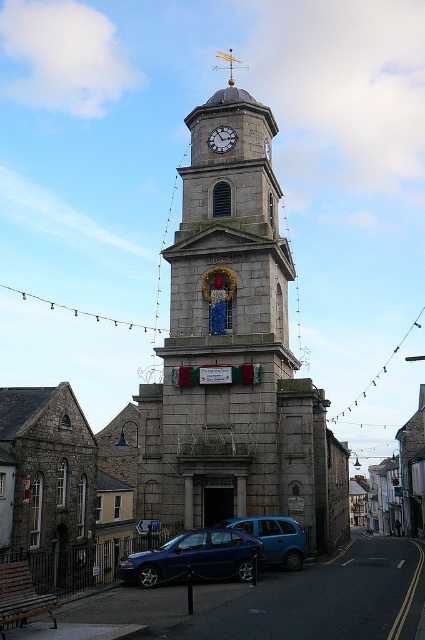
You are an architect planning to install a new decorative element on the stone clock tower at center. You have a sculpture that is 2 meters wide. The white stone clock at center is currently occupying space on the tower. Can the sculpture be placed on the tower without overlapping the clock?

The stone clock tower at center might be wider than the white stone clock at center, so there is a possibility that the sculpture can be placed on the tower without overlapping the clock. However, since the exact width difference isn not specified, it is recommended to measure the available space before installation.

You are driving a metallic blue sedan at center and want to park it directly in front of the white stone clock at center. Based on the scene, is there enough space to park the car without blocking the entrance of the tower?

The metallic blue sedan at center is positioned on the left side of white stone clock at center, so there is space to park the car directly in front of the white stone clock at center without blocking the entrance since the entrance is flanked by two smaller arches on either side, providing clearance for parking.

You are a photographer planning to capture the stone clock tower at center and the metallic blue sedan at center in a single frame. Based on their sizes, which object should you position closer to the camera to ensure both are clearly visible in the photo?

The stone clock tower at center is larger than the metallic blue sedan at center. To ensure both are clearly visible, position the metallic blue sedan at center closer to the camera so its size matches the tower in the frame.